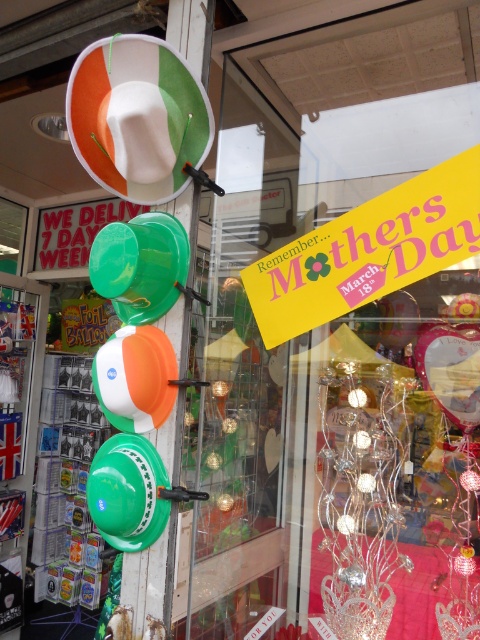
Is white matte balloon at upper center behind green plastic bucket at center?

No, it is in front of green plastic bucket at center.

Who is positioned more to the left, white matte balloon at upper center or green plastic bucket at center?

Positioned to the left is green plastic bucket at center.

Identify the location of white matte balloon at upper center. (137, 116).

You are a GUI agent. You are given a task and a screenshot of the screen. Output one action in this format:
    pyautogui.click(x=<x>, y=<y>)
    Task: Click on the white matte balloon at upper center
    The image size is (480, 640).
    Given the screenshot: What is the action you would take?
    pyautogui.click(x=137, y=116)

From the picture: Is green plastic bucket at center further to camera compared to green matte balloon at left?

Yes, green plastic bucket at center is further from the viewer.

Between point (162, 227) and point (108, 442), which one is positioned in front?

Point (162, 227) is more forward.

What do you see at coordinates (141, 266) in the screenshot?
I see `green plastic bucket at center` at bounding box center [141, 266].

Find the location of a particular element. Image resolution: width=480 pixels, height=640 pixels. green plastic bucket at center is located at coordinates (141, 266).

Does white matte balloon at upper center have a larger size compared to green matte balloon at left?

Indeed, white matte balloon at upper center has a larger size compared to green matte balloon at left.

Is white matte balloon at upper center behind green matte balloon at left?

No, it is not.

Measure the distance between point (x=120, y=61) and camera.

A distance of 1.28 meters exists between point (x=120, y=61) and camera.

Identify the location of white matte balloon at upper center. (137, 116).